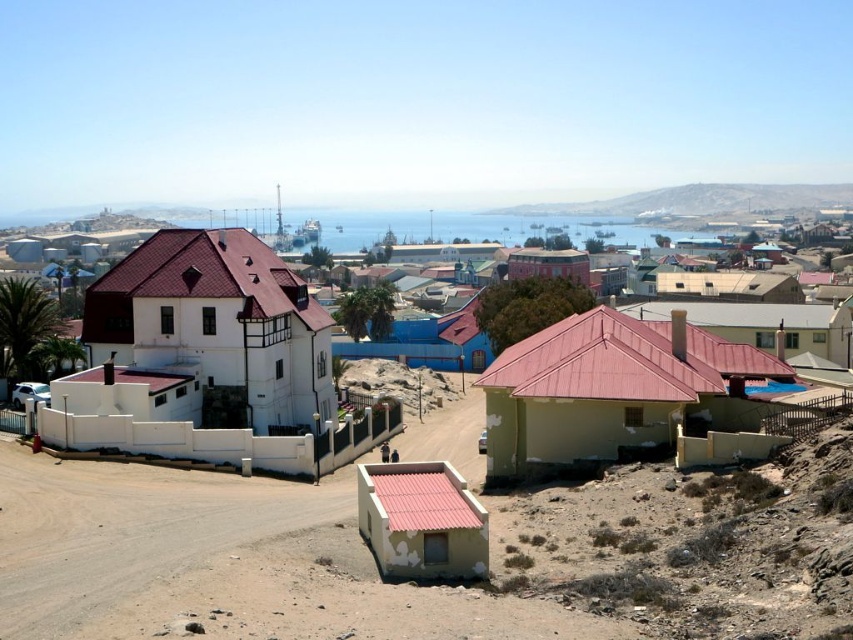
Question: Which point is closer to the camera taking this photo?

Choices:
 (A) (100, 349)
 (B) (125, 332)

Answer: (B)

Question: Can you confirm if white matte house at center is wider than matte red building at center?

Choices:
 (A) yes
 (B) no

Answer: (A)

Question: Which object appears farthest from the camera in this image?

Choices:
 (A) light beige corrugated metal hut at lower center
 (B) white matte house at left
 (C) white matte house at center

Answer: (B)

Question: Which point is farther to the camera?

Choices:
 (A) (747, 364)
 (B) (541, 256)

Answer: (B)

Question: Considering the relative positions of white matte house at left and light beige corrugated metal hut at lower center in the image provided, where is white matte house at left located with respect to light beige corrugated metal hut at lower center?

Choices:
 (A) right
 (B) left

Answer: (B)

Question: Where is white matte house at center located in relation to light beige corrugated metal hut at lower center in the image?

Choices:
 (A) above
 (B) below

Answer: (A)